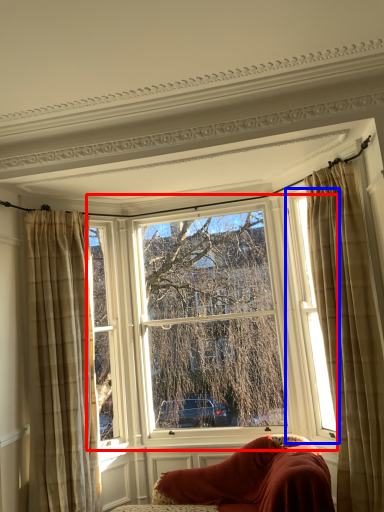
Question: Which point is closer to the camera, window (highlighted by a red box) or window (highlighted by a blue box)?

Choices:
 (A) window
 (B) window

Answer: (B)